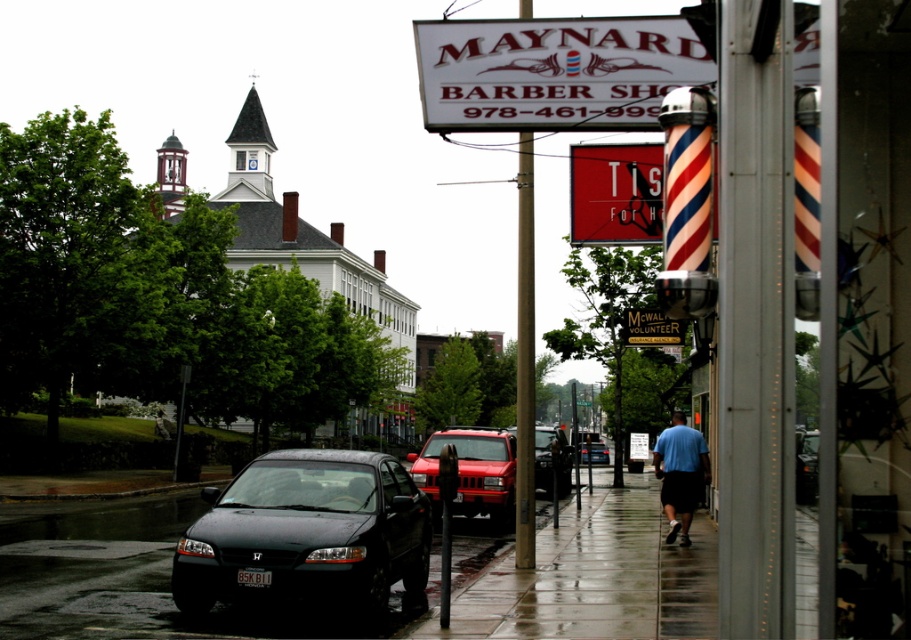
You are a pedestrian standing on the sidewalk and see the shiny red suv at center and the light blue shirt at center. Which object is closer to the parked black car?

The shiny red suv at center is positioned on the left side of light blue shirt at center, so the shiny red suv at center is closer to the parked black car.

You are a delivery driver approaching the street where the white plastic sign at upper center and the shiny red suv at center are visible. Based on their positions, which object would you see first as you drive towards the intersection ahead?

The white plastic sign at upper center would be seen first because it is positioned above the shiny red suv at center, meaning it is closer to the driver as they approach.